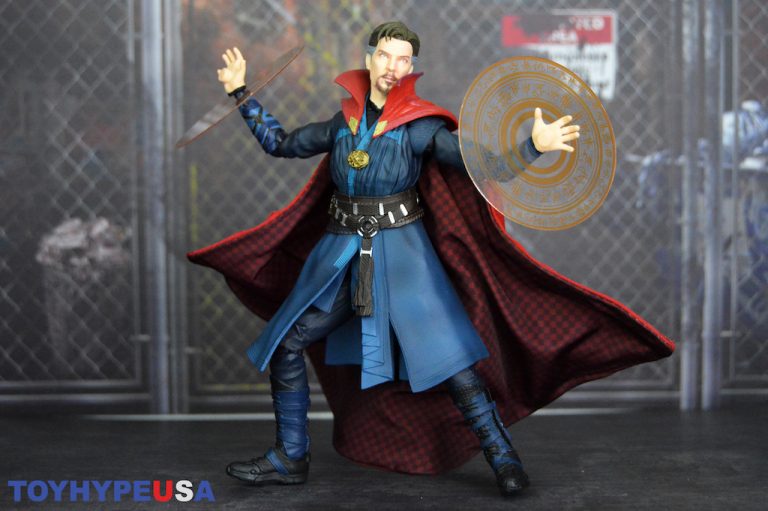
Locate an element on the screen. This screenshot has height=511, width=768. gray floor is located at coordinates (409, 482).